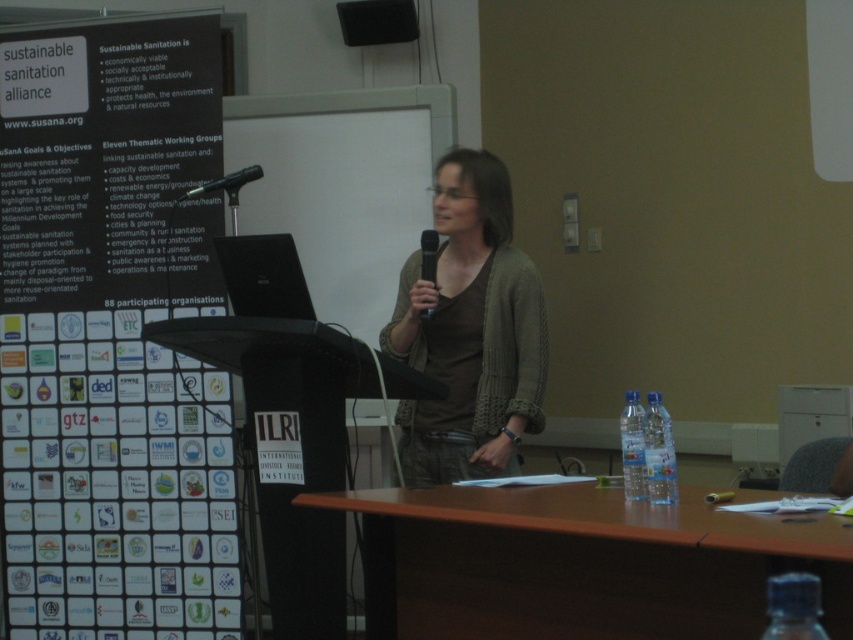
Question: In this image, where is clear plastic bottle at right located relative to black plastic microphone at center?

Choices:
 (A) right
 (B) left

Answer: (A)

Question: Is black matte podium at center bigger than clear plastic bottle at table right?

Choices:
 (A) no
 (B) yes

Answer: (B)

Question: Estimate the real-world distances between objects in this image. Which object is farther from the transparent plastic bottle at lower right?

Choices:
 (A) green knitted cardigan at center
 (B) clear plastic bottle at table right
 (C) black matte podium at center

Answer: (A)

Question: Based on their relative distances, which object is nearer to the clear plastic bottle at right?

Choices:
 (A) black matte microphone at upper center
 (B) black matte podium at center
 (C) brown wooden table at center
 (D) matte black speaker at upper center

Answer: (C)

Question: Is clear plastic bottle at table right to the right of black matte microphone at upper center from the viewer's perspective?

Choices:
 (A) no
 (B) yes

Answer: (B)

Question: Among these objects, which one is nearest to the camera?

Choices:
 (A) black matte microphone at upper center
 (B) clear plastic bottle at table right

Answer: (B)